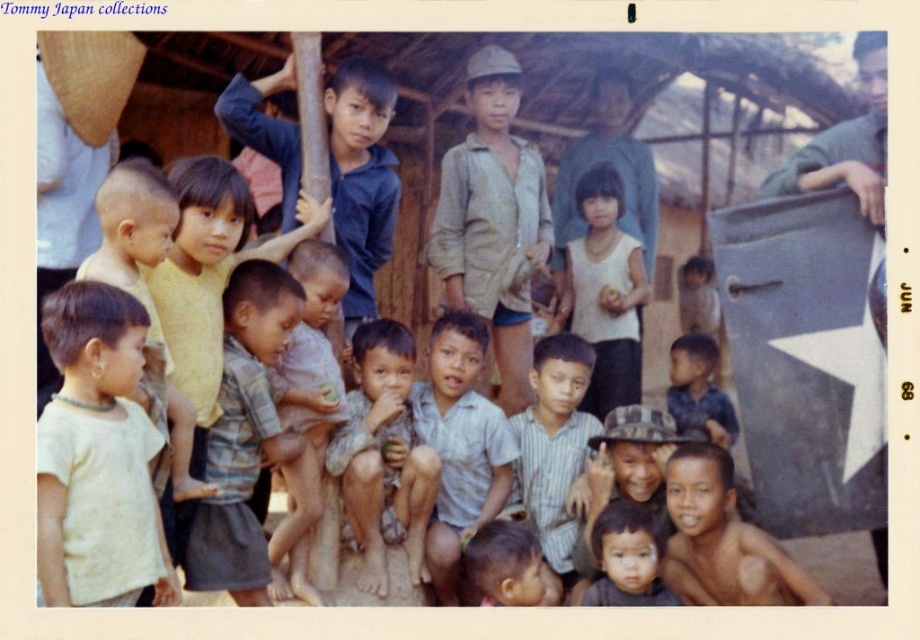
Question: Which of these objects is positioned closest to the white matte tank top at center?

Choices:
 (A) light brown fabric shirt at center
 (B) smooth skin baby at lower center

Answer: (A)

Question: From the image, what is the correct spatial relationship of white matte shirt at left in relation to blue denim shirt at upper left?

Choices:
 (A) above
 (B) below

Answer: (B)

Question: Does light brown fabric shirt at center lie behind brown skin boy at center?

Choices:
 (A) no
 (B) yes

Answer: (B)

Question: Is light brown fabric shirt at center wider than blue striped shirt at center?

Choices:
 (A) no
 (B) yes

Answer: (B)

Question: Which object appears closest to the camera in this image?

Choices:
 (A) brown skin boy at center
 (B) light brown fabric shirt at center

Answer: (A)

Question: Which object is farther from the camera taking this photo?

Choices:
 (A) white matte tank top at center
 (B) brown textured shirt at center
 (C) blue denim shirt at upper left

Answer: (A)